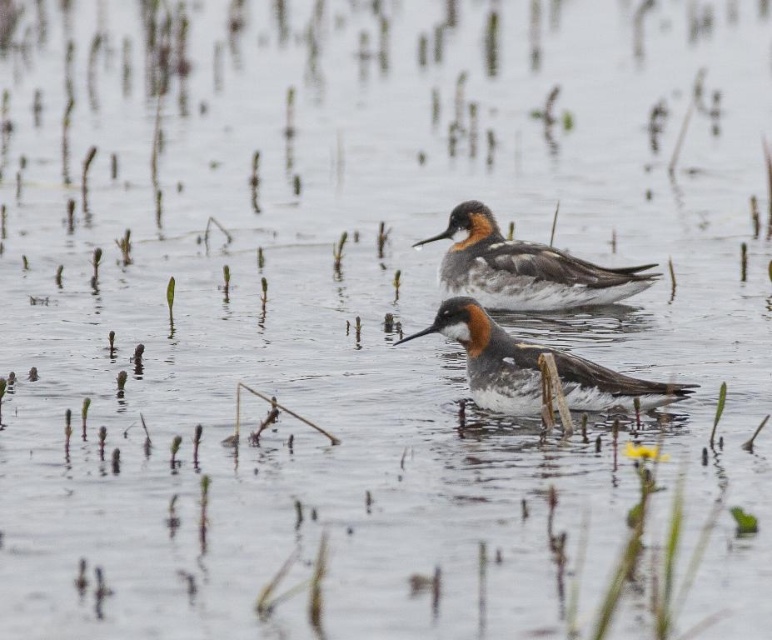
You are standing in a marshy area and see a brown speckled duck at center. Can you confirm if the point marked at coordinates (x=523, y=268) corresponds to the location of the brown speckled duck at center?

Yes, the point marked at coordinates (x=523, y=268) corresponds to the location of the brown speckled duck at center as stated in the description.